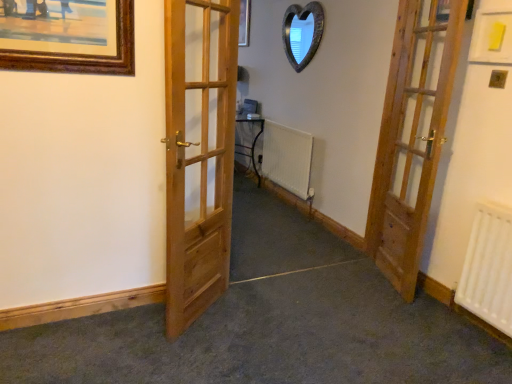
Question: Would you say wooden heart-shaped mirror at upper center is inside or outside wooden door at right, positioned as the second door in left-to-right order?

Choices:
 (A) inside
 (B) outside

Answer: (B)

Question: Considering the positions of point (297, 69) and point (376, 231), is point (297, 69) closer or farther from the camera than point (376, 231)?

Choices:
 (A) farther
 (B) closer

Answer: (A)

Question: Which object is the closest to the white matte radiator at center, which appears as the 1th radiator when viewed from the left?

Choices:
 (A) wooden door at right, positioned as the second door in left-to-right order
 (B) white matte radiator at lower right, the 2th radiator positioned from the top
 (C) wooden heart-shaped mirror at upper center
 (D) natural wood door at center, which is counted as the first door, starting from the left

Answer: (C)

Question: Which object is positioned closest to the wooden door at right, which ranks as the 1th door in right-to-left order?

Choices:
 (A) white matte radiator at lower right, placed as the first radiator when sorted from bottom to top
 (B) wooden heart-shaped mirror at upper center
 (C) natural wood door at center, acting as the second door starting from the right
 (D) white matte radiator at center, which is the first radiator from top to bottom

Answer: (A)